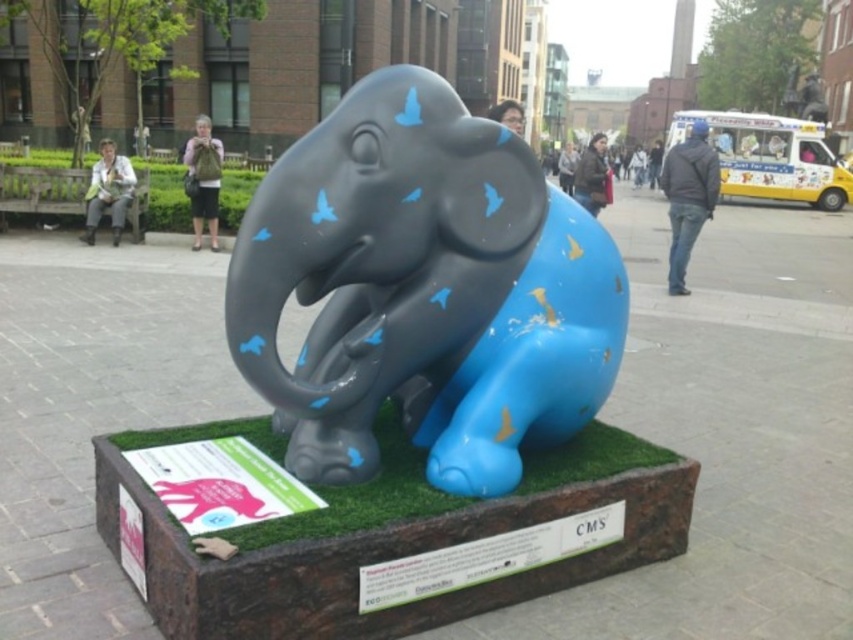
You are standing in front of the public art installation described. You see a point marked at coordinates (422, 291). What object is located at that specific point?

The point at coordinates (422, 291) is occupied by the matte black elephant at center.

You are a visitor standing in front of the public art installation. You want to take a photo of the blue matte elephant at center without the green artificial turf at center appearing in the background. Is this possible?

The green artificial turf at center is behind the blue matte elephant at center, so if you position yourself in front of the blue matte elephant at center and aim the camera towards it, the green artificial turf at center will be behind it and may still appear in the background. To exclude the green artificial turf at center, you would need to move to a position where the blue matte elephant at center blocks the view of the green artificial turf at center entirely, but given their spatial arrangement, this